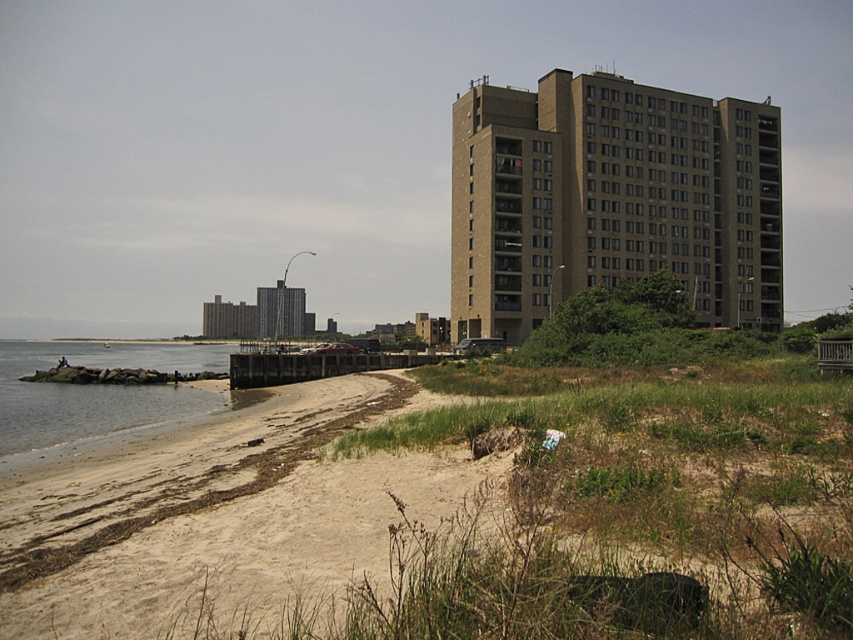
You are standing on the beach and want to take a photo of the brown brick building at upper right without the clear water at lower left in the background. Is this possible given their positions?

The clear water at lower left is behind the brown brick building at upper right, so if you position yourself in front of the building, the water will not be visible in the background. Therefore, it is possible to take a photo of the brown brick building at upper right without the clear water at lower left in the background.

You are standing at the point marked by the coordinates point (x=509, y=525). Looking towards the high rise buildings, which direction should you walk to reach the concrete jetty extending into the water?

The point (x=509, y=525) marks the sandy beach at lower left. To reach the concrete jetty extending into the water from the center left, you should walk towards the center left from your current position on the sandy beach at lower left.